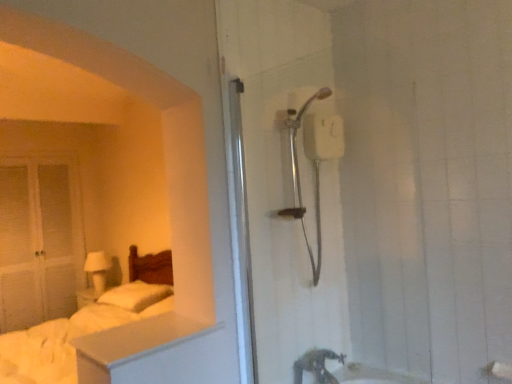
Question: Can white soft bed at left be found inside white soft pillow at left?

Choices:
 (A) yes
 (B) no

Answer: (B)

Question: From the image's perspective, does white soft pillow at left appear higher than white soft bed at left?

Choices:
 (A) no
 (B) yes

Answer: (B)

Question: Can you confirm if white soft pillow at left is wider than white soft bed at left?

Choices:
 (A) no
 (B) yes

Answer: (A)

Question: Is white soft pillow at left taller than white soft bed at left?

Choices:
 (A) no
 (B) yes

Answer: (A)

Question: Is white soft pillow at left at the left side of white soft bed at left?

Choices:
 (A) no
 (B) yes

Answer: (A)

Question: Considering the positions of white matte dresser at lower left and white matte glass door at left in the image, is white matte dresser at lower left taller or shorter than white matte glass door at left?

Choices:
 (A) tall
 (B) short

Answer: (B)

Question: From a real-world perspective, is white matte dresser at lower left physically located above or below white matte glass door at left?

Choices:
 (A) above
 (B) below

Answer: (B)

Question: Is white matte dresser at lower left spatially inside white matte glass door at left, or outside of it?

Choices:
 (A) inside
 (B) outside

Answer: (B)

Question: In the image, is white matte dresser at lower left positioned in front of or behind white matte glass door at left?

Choices:
 (A) behind
 (B) front

Answer: (B)

Question: Is white matte glass door at left taller or shorter than matte silver tap at lower center?

Choices:
 (A) short
 (B) tall

Answer: (B)

Question: Is white matte glass door at left situated inside matte silver tap at lower center or outside?

Choices:
 (A) inside
 (B) outside

Answer: (B)

Question: From the image's perspective, is white matte glass door at left positioned above or below matte silver tap at lower center?

Choices:
 (A) below
 (B) above

Answer: (B)

Question: Is point (62, 192) positioned closer to the camera than point (324, 375)?

Choices:
 (A) closer
 (B) farther

Answer: (B)

Question: Is point click(x=130, y=306) positioned closer to the camera than point click(x=11, y=210)?

Choices:
 (A) farther
 (B) closer

Answer: (B)

Question: Considering their positions, is white soft pillow at left located in front of or behind white matte glass door at left?

Choices:
 (A) behind
 (B) front

Answer: (B)